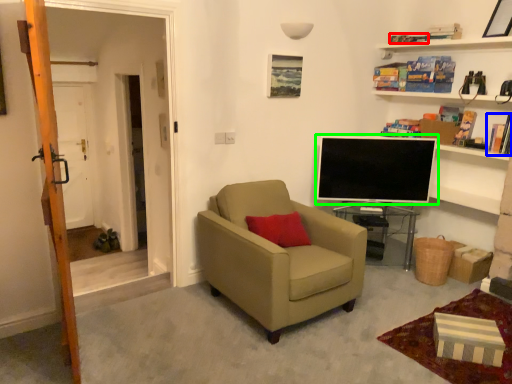
Question: Considering the real-world distances, which object is farthest from book (highlighted by a red box)? book (highlighted by a blue box) or television (highlighted by a green box)?

Choices:
 (A) book
 (B) television

Answer: (B)